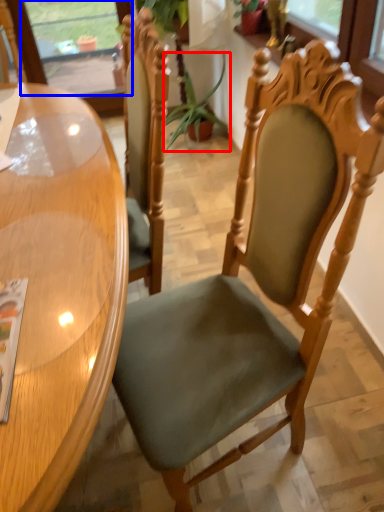
Question: Which object is further to the camera taking this photo, plant (highlighted by a red box) or window screen (highlighted by a blue box)?

Choices:
 (A) plant
 (B) window screen

Answer: (B)